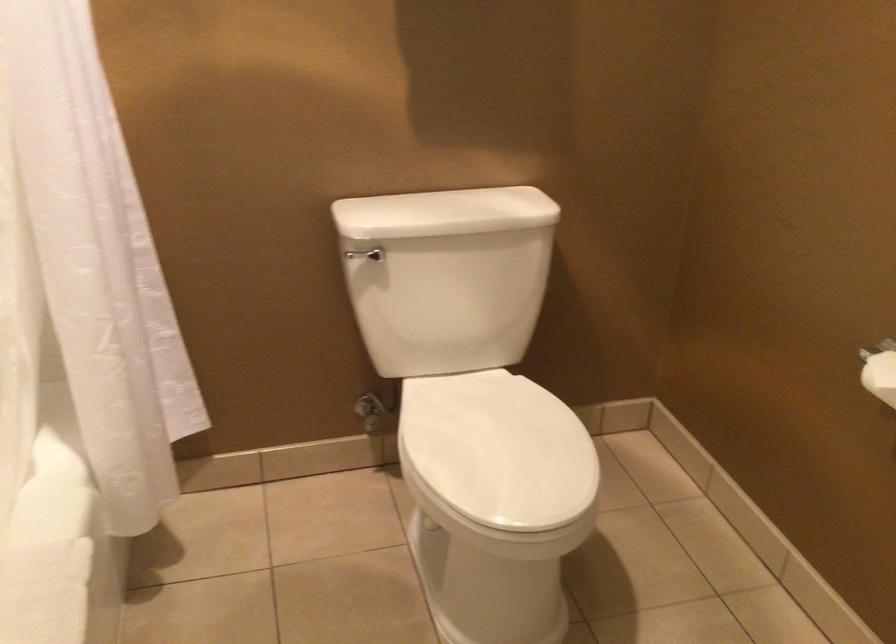
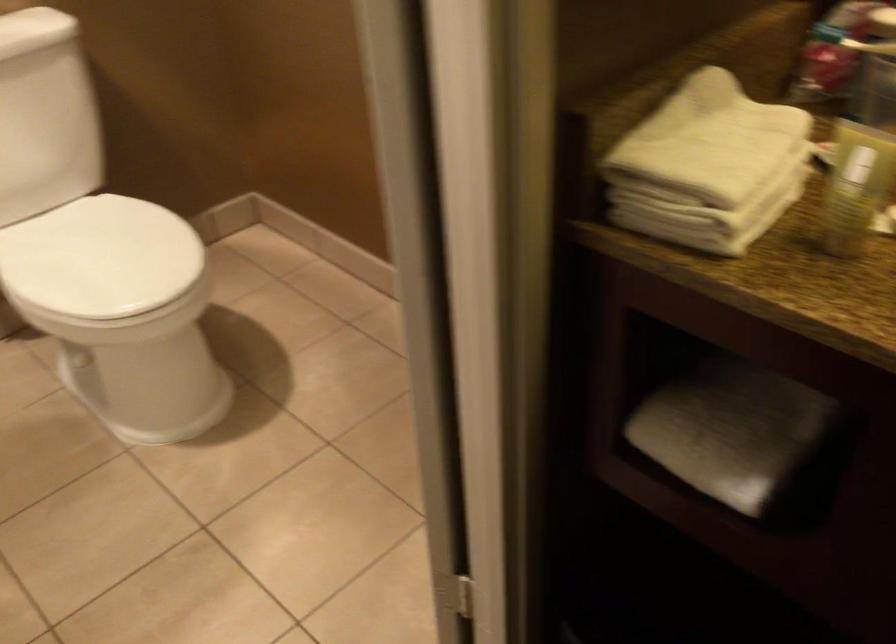
Find the pixel in the second image that matches point (494, 449) in the first image.

(99, 257)